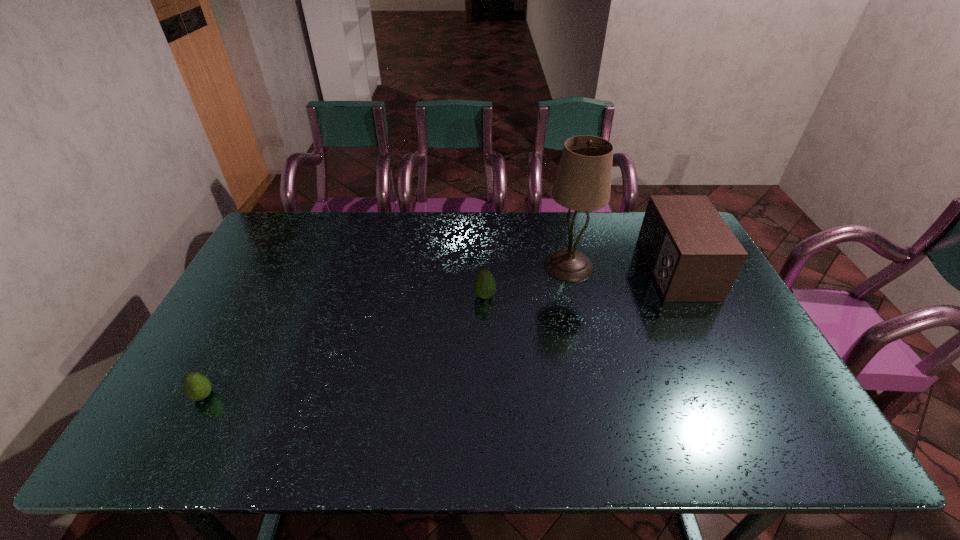
At what (x,y) coordinates should I click in order to perform the action: click on free space located 0.380m on the front-facing side of the second tallest object. Please return your answer as a coordinate pair (x, y). Looking at the image, I should click on (525, 269).

This screenshot has width=960, height=540. What are the coordinates of `free spot located 0.370m on the front-facing side of the second tallest object` in the screenshot? It's located at (528, 269).

Image resolution: width=960 pixels, height=540 pixels. I want to click on vacant space located 0.220m on the left of the taller avocado, so click(x=400, y=296).

The image size is (960, 540). Identify the location of free region located 0.270m on the right of the shorter avocado. (326, 396).

Image resolution: width=960 pixels, height=540 pixels. Identify the location of lampshade located in the far edge section of the desktop. 583,181.

Find the location of a particular element. The width and height of the screenshot is (960, 540). radio receiver that is positioned at the far edge is located at coordinates (693, 255).

This screenshot has width=960, height=540. What are the coordinates of `object located in the left edge section of the desktop` in the screenshot? It's located at (196, 386).

Locate an element on the screen. The image size is (960, 540). object present at the right edge is located at coordinates (693, 255).

The height and width of the screenshot is (540, 960). What are the coordinates of `object situated at the far right corner` in the screenshot? It's located at (693, 255).

In the image, there is a desktop. Find the location of `blank space at the far edge`. blank space at the far edge is located at coordinates (466, 242).